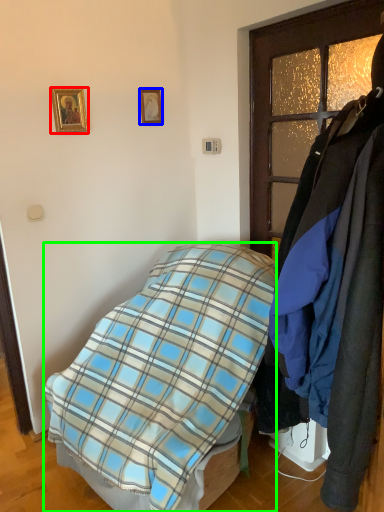
Question: Which object is positioned closest to picture frame (highlighted by a red box)? Select from picture frame (highlighted by a blue box) and bed (highlighted by a green box).

Choices:
 (A) picture frame
 (B) bed

Answer: (A)